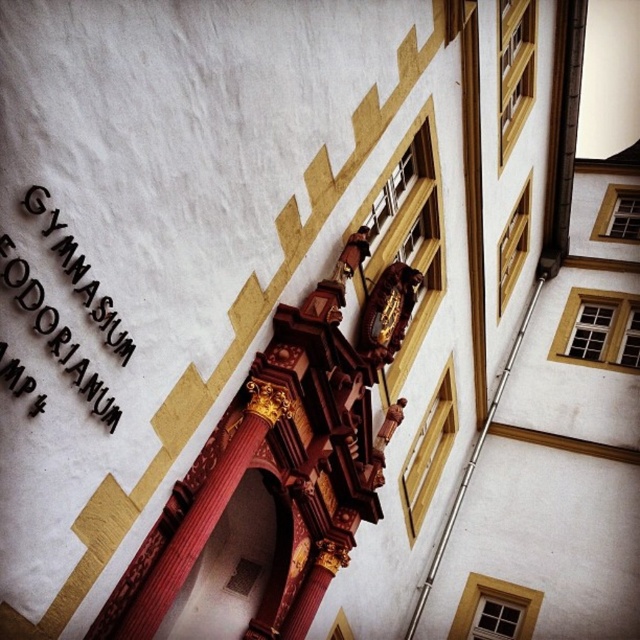
Question: Among these objects, which one is farthest from the camera?

Choices:
 (A) black metal sign at upper left
 (B) gold polished wood clock at center

Answer: (B)

Question: Which point is closer to the camera taking this photo?

Choices:
 (A) (410, 312)
 (B) (83, 396)

Answer: (B)

Question: In this image, where is black metal sign at upper left located relative to gold polished wood clock at center?

Choices:
 (A) below
 (B) above

Answer: (A)

Question: Is the position of black metal sign at upper left less distant than that of gold polished wood clock at center?

Choices:
 (A) yes
 (B) no

Answer: (A)

Question: Which point is closer to the camera?

Choices:
 (A) gold polished wood clock at center
 (B) black metal sign at upper left

Answer: (B)

Question: Is black metal sign at upper left thinner than gold polished wood clock at center?

Choices:
 (A) no
 (B) yes

Answer: (B)